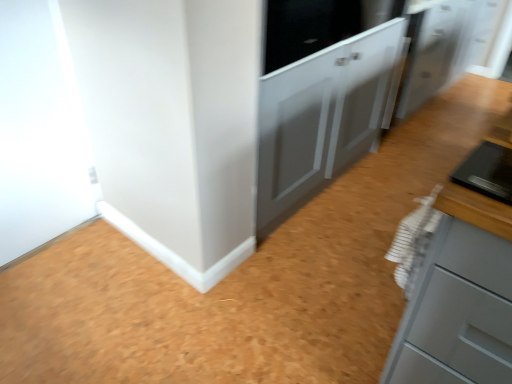
Where is `empty space that is to the right of matte gray cabinet at center`? empty space that is to the right of matte gray cabinet at center is located at coordinates (394, 174).